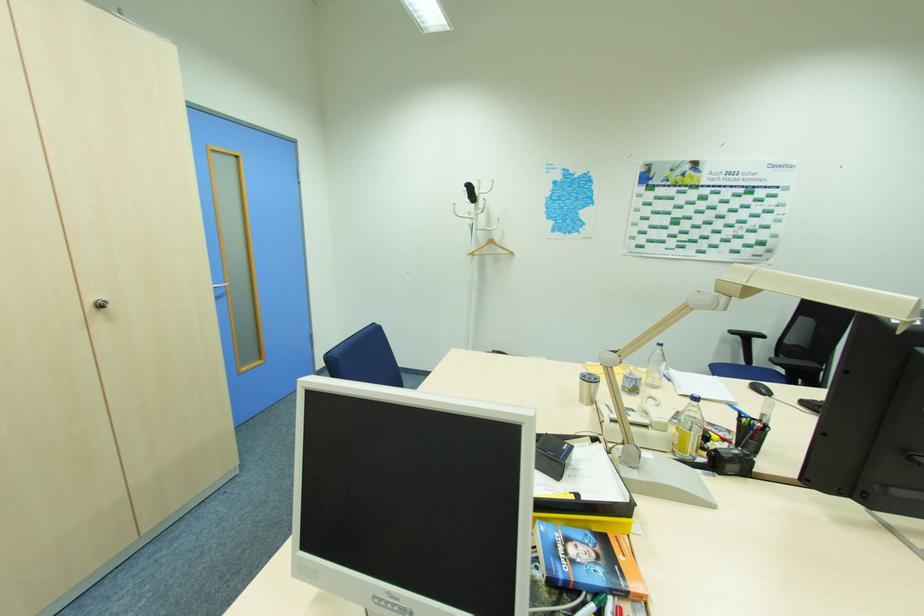
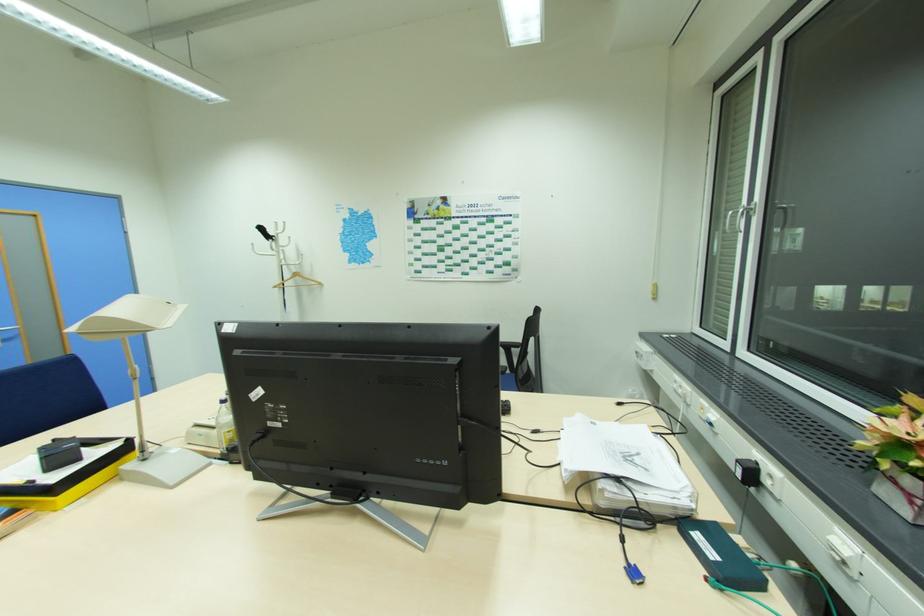
Find the pixel in the second image that matches [472,254] in the first image.

(277, 286)